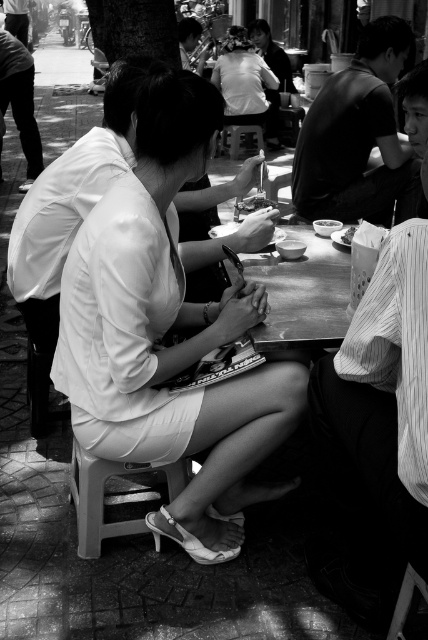
Does striped fabric shirt at right have a larger size compared to white plastic stool at center?

Yes, striped fabric shirt at right is bigger than white plastic stool at center.

Is point (383, 412) closer to viewer compared to point (244, 132)?

Yes, point (383, 412) is in front of point (244, 132).

Where is `striped fabric shirt at right`? The height and width of the screenshot is (640, 428). striped fabric shirt at right is located at coordinates (376, 436).

Does point (184, 65) lie in front of point (235, 147)?

No, (184, 65) is behind (235, 147).

Find the location of a particular element. The height and width of the screenshot is (640, 428). smooth wooden guitar at center is located at coordinates (190, 44).

Can you confirm if smooth plastic spoon at center is positioned above white paper bag at center?

Indeed, smooth plastic spoon at center is positioned over white paper bag at center.

The width and height of the screenshot is (428, 640). Describe the element at coordinates (255, 204) in the screenshot. I see `smooth plastic spoon at center` at that location.

Image resolution: width=428 pixels, height=640 pixels. Identify the location of smooth plastic spoon at center. (255, 204).